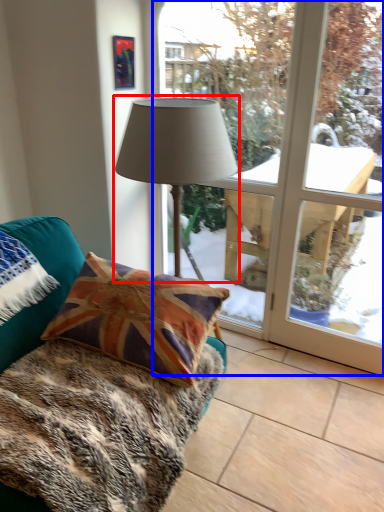
Question: Among these objects, which one is farthest to the camera, lamp (highlighted by a red box) or bay window (highlighted by a blue box)?

Choices:
 (A) lamp
 (B) bay window

Answer: (B)